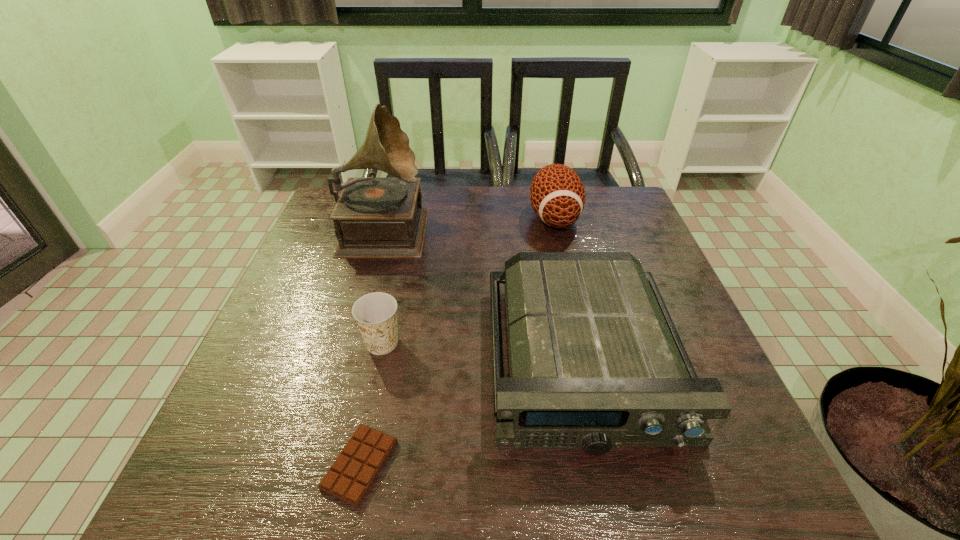
You are a GUI agent. You are given a task and a screenshot of the screen. Output one action in this format:
    pyautogui.click(x=<x>, y=<y>)
    Task: Click on the vacant region at the right edge
    The width and height of the screenshot is (960, 540).
    Given the screenshot: What is the action you would take?
    pyautogui.click(x=654, y=273)

You are a GUI agent. You are given a task and a screenshot of the screen. Output one action in this format:
    pyautogui.click(x=<x>, y=<y>)
    Task: Click on the vacant point at the far left corner
    
    Given the screenshot: What is the action you would take?
    pyautogui.click(x=326, y=205)

Image resolution: width=960 pixels, height=540 pixels. In order to click on vacant area at the far right corner of the desktop in this screenshot , I will do `click(602, 227)`.

Locate an element on the screen. vacant space that is in between the Dixie cup and the shortest object is located at coordinates (372, 404).

I want to click on free spot between the Dixie cup and the football, so click(x=468, y=280).

The height and width of the screenshot is (540, 960). I want to click on vacant region between the record player and the radio receiver, so click(x=484, y=293).

You are a GUI agent. You are given a task and a screenshot of the screen. Output one action in this format:
    pyautogui.click(x=<x>, y=<y>)
    Task: Click on the vacant region between the candy bar and the Dixie cup
    The image size is (960, 540).
    Given the screenshot: What is the action you would take?
    (x=372, y=404)

The height and width of the screenshot is (540, 960). What are the coordinates of `free space between the shortest object and the radio receiver` in the screenshot? It's located at (471, 412).

The image size is (960, 540). I want to click on empty space between the record player and the Dixie cup, so click(x=383, y=285).

The image size is (960, 540). What are the coordinates of `unoccupied area between the tallest object and the radio receiver` in the screenshot? It's located at (484, 293).